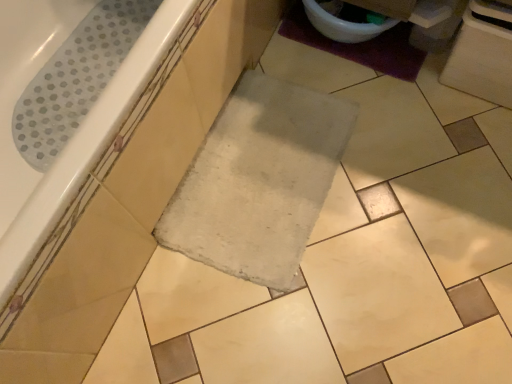
Question: From a real-world perspective, is white glossy toilet bowl at upper right physically located above or below purple fuzzy bath mat at upper right?

Choices:
 (A) below
 (B) above

Answer: (B)

Question: Would you say white glossy toilet bowl at upper right is inside or outside purple fuzzy bath mat at upper right?

Choices:
 (A) outside
 (B) inside

Answer: (A)

Question: Which object is the farthest from the purple fuzzy bath mat at upper right?

Choices:
 (A) white glossy toilet bowl at upper right
 (B) white glossy bathtub at upper left

Answer: (B)

Question: Which object is the farthest from the white glossy toilet bowl at upper right?

Choices:
 (A) white glossy bathtub at upper left
 (B) purple fuzzy bath mat at upper right

Answer: (A)